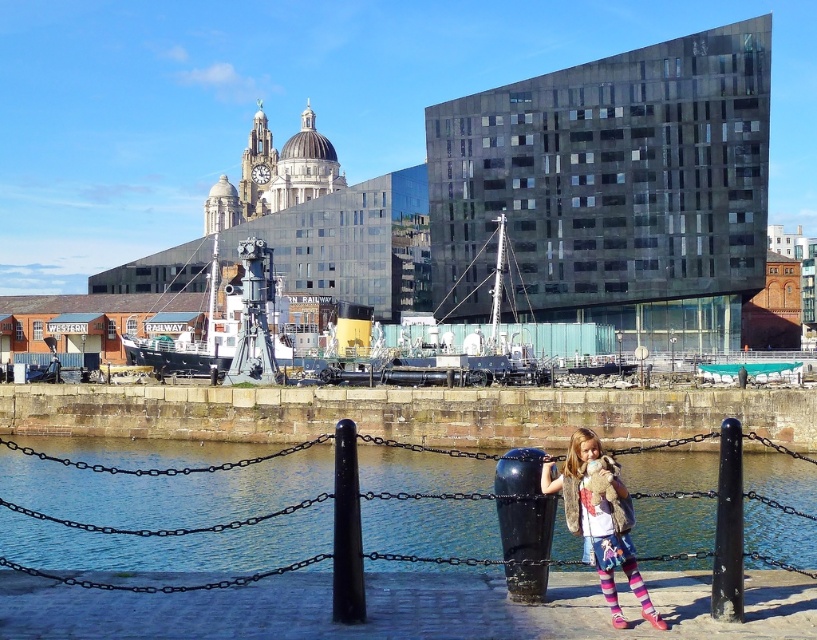
Question: Which of the following is the closest to the observer?

Choices:
 (A) (320, 532)
 (B) (574, 465)
 (C) (155, 369)
 (D) (358, 492)

Answer: (D)

Question: Is clear blue water at lower center wider than black matte pole at lower right?

Choices:
 (A) no
 (B) yes

Answer: (B)

Question: Which of the following is the closest to the observer?

Choices:
 (A) (340, 428)
 (B) (583, 520)

Answer: (A)

Question: Does clear blue water at lower center appear on the right side of black smooth pole at center?

Choices:
 (A) no
 (B) yes

Answer: (A)

Question: Can you confirm if clear blue water at lower center is positioned above black metal ship at center?

Choices:
 (A) no
 (B) yes

Answer: (A)

Question: Which of these objects is positioned farthest from the black smooth pole at center?

Choices:
 (A) clear blue water at lower center
 (B) black matte pole at lower right

Answer: (B)